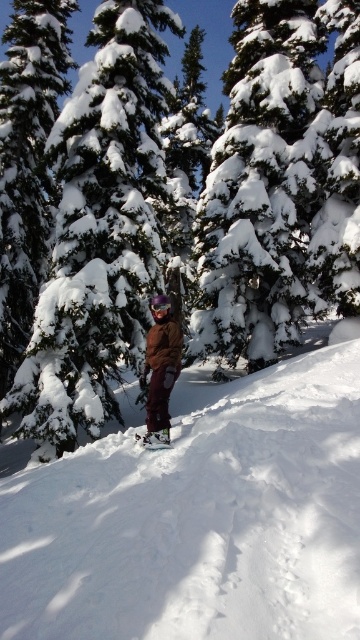
You are a snowboarder standing at the edge of the slope and want to know where the deepest snow is. According to the coordinates provided, where is the white powdery snow at center located?

The white powdery snow at center is located at point (199,518), which is the deepest snow area in the scene.

You are a snowboarder preparing to descend the slope. You notice two types of snow on the slope. Which type of snow is closer to you, the white powdery snow at center or the green matte snow at center?

The white powdery snow at center is closer to the viewer than the green matte snow at center.